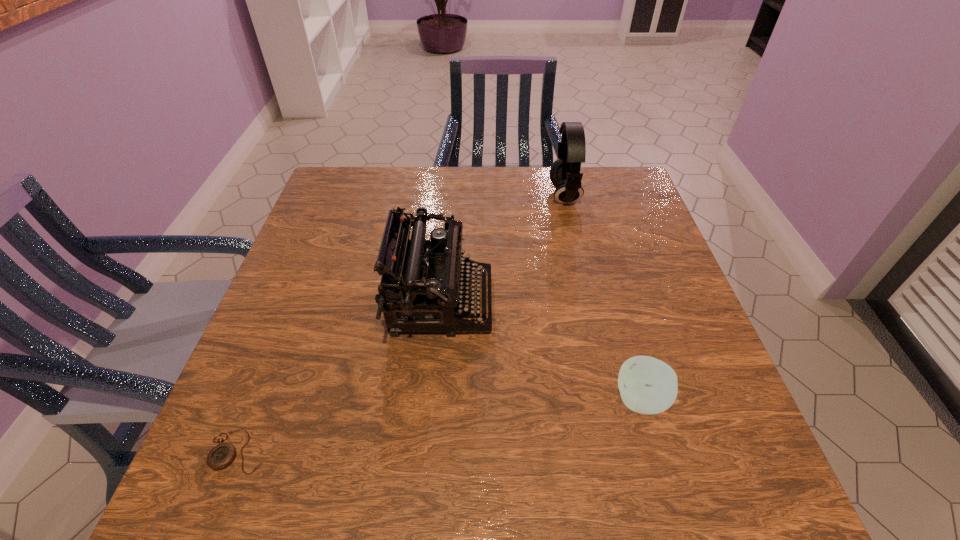
Where is `free space that satisfies the following two spatial constraints: 1. on the ear cups of the third tallest object; 2. on the left side of the farthest object`? The height and width of the screenshot is (540, 960). free space that satisfies the following two spatial constraints: 1. on the ear cups of the third tallest object; 2. on the left side of the farthest object is located at coordinates (612, 400).

This screenshot has width=960, height=540. Identify the location of free space in the image that satisfies the following two spatial constraints: 1. on the back side of the third tallest object; 2. on the right side of the pocket watch. (259, 400).